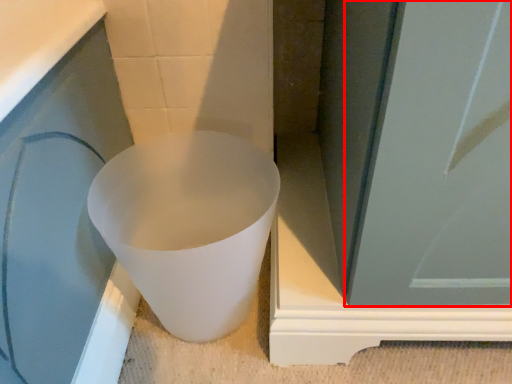
Question: From the image's perspective, where is screen door (annotated by the red box) located relative to toilet?

Choices:
 (A) below
 (B) above

Answer: (B)